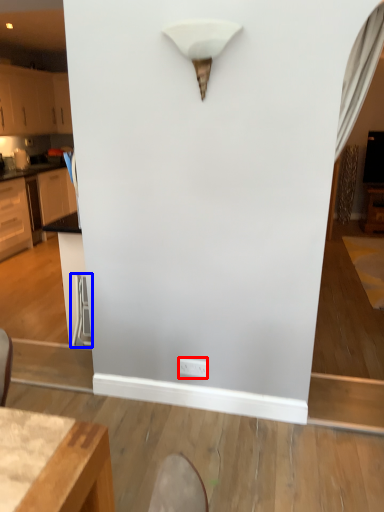
Question: Which point is further to the camera, electric outlet (highlighted by a red box) or swivel chair (highlighted by a blue box)?

Choices:
 (A) electric outlet
 (B) swivel chair

Answer: (B)